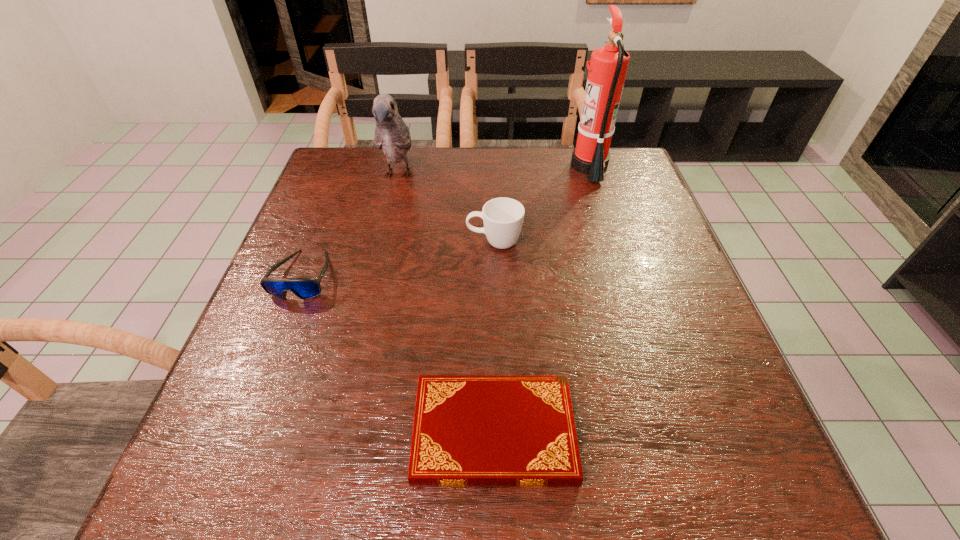
You are a GUI agent. You are given a task and a screenshot of the screen. Output one action in this format:
    pyautogui.click(x=<x>, y=<y>)
    Task: Click on the fire extinguisher at the far edge
    This screenshot has width=960, height=540.
    Given the screenshot: What is the action you would take?
    pyautogui.click(x=608, y=65)

Where is `parrot situated at the far edge`? The image size is (960, 540). parrot situated at the far edge is located at coordinates (392, 135).

I want to click on object that is at the near edge, so click(x=469, y=430).

Image resolution: width=960 pixels, height=540 pixels. I want to click on object at the left edge, so click(x=305, y=288).

Find the location of `object at the right edge`. object at the right edge is located at coordinates (608, 65).

At what (x,y) coordinates should I click in order to perform the action: click on object at the far right corner. Please return your answer as a coordinate pair (x, y). The image size is (960, 540). Looking at the image, I should click on (608, 65).

Locate an element on the screen. vacant region at the far edge of the desktop is located at coordinates (498, 153).

Image resolution: width=960 pixels, height=540 pixels. Identify the location of vacant space at the left edge of the desktop. (357, 227).

The width and height of the screenshot is (960, 540). I want to click on vacant area at the right edge, so click(x=601, y=225).

This screenshot has height=540, width=960. What are the coordinates of `free space at the far left corner of the desktop` in the screenshot? It's located at (339, 164).